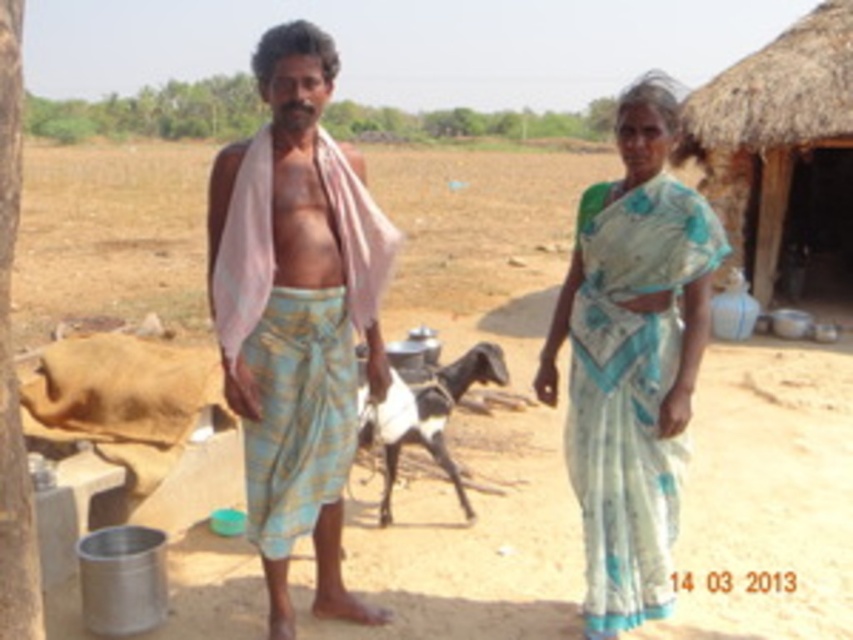
Does light blue printed saree at center appear under light blue woven dhoti at center?

Indeed, light blue printed saree at center is positioned under light blue woven dhoti at center.

The height and width of the screenshot is (640, 853). I want to click on light blue printed saree at center, so click(x=294, y=310).

Locate an element on the screen. The height and width of the screenshot is (640, 853). light blue printed saree at center is located at coordinates [x=294, y=310].

Is light blue printed saree at center taller than black and white fur goat at center?

Incorrect, light blue printed saree at center's height is not larger of black and white fur goat at center's.

Who is more distant from viewer, (264, 449) or (444, 426)?

Point (444, 426)

Identify the location of light blue printed saree at center. (294, 310).

Identify the location of light blue printed saree at center. (294, 310).

Which is in front, point (376, 380) or point (775, 88)?

Point (376, 380) is more forward.

Is point (329, 368) more distant than point (798, 109)?

No, it is not.

This screenshot has width=853, height=640. What are the coordinates of `light blue woven dhoti at center` in the screenshot? It's located at (296, 314).